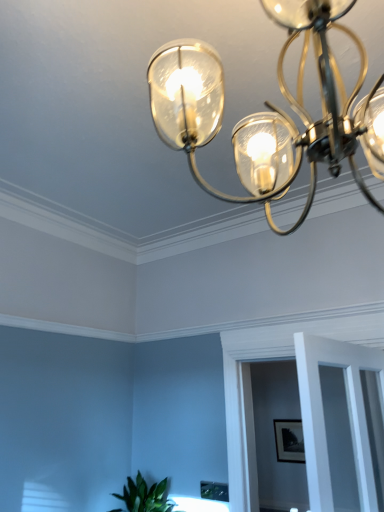
Question: Based on their positions, is matte black picture frame at center located to the left or right of clear glass door at center?

Choices:
 (A) left
 (B) right

Answer: (B)

Question: Choose the correct answer: Is matte black picture frame at center inside clear glass door at center or outside it?

Choices:
 (A) inside
 (B) outside

Answer: (B)

Question: Estimate the real-world distances between objects in this image. Which object is closer to the clear glass door at center?

Choices:
 (A) clear glass chandelier at upper center
 (B) matte black picture frame at center

Answer: (A)

Question: Which object is positioned closest to the clear glass door at center?

Choices:
 (A) clear glass chandelier at upper center
 (B) matte black picture frame at center

Answer: (A)